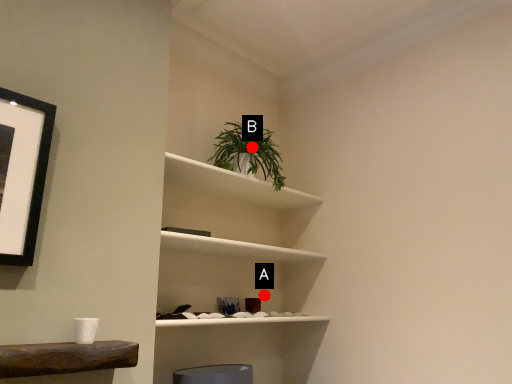
Question: Two points are circled on the image, labeled by A and B beside each circle. Which point is farther from the camera taking this photo?

Choices:
 (A) A is further
 (B) B is further

Answer: (A)